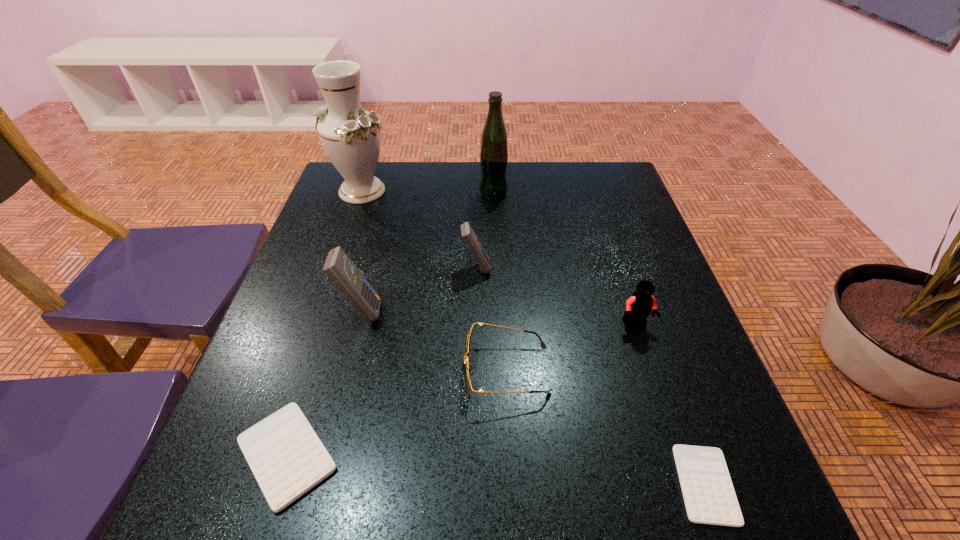
Locate which calculator ranks in proximity to the third tallest object. Please provide its 2D coordinates. Your answer should be formatted as a tuple, i.e. [(x, y)], where the tuple contains the x and y coordinates of a point satisfying the conditions above.

[(468, 234)]

Identify which calculator is located as the second nearest to the vase. Please provide its 2D coordinates. Your answer should be formatted as a tuple, i.e. [(x, y)], where the tuple contains the x and y coordinates of a point satisfying the conditions above.

[(338, 267)]

Find the location of a particular element. This screenshot has width=960, height=540. free space that satisfies the following two spatial constraints: 1. on the front side of the vase; 2. on the right side of the green beer bottle is located at coordinates (362, 193).

Locate an element on the screen. Image resolution: width=960 pixels, height=540 pixels. vacant space that satisfies the following two spatial constraints: 1. on the front side of the right white calculator; 2. on the right side of the tallest object is located at coordinates (260, 484).

The height and width of the screenshot is (540, 960). Identify the location of vacant space that satisfies the following two spatial constraints: 1. on the front side of the tallest object; 2. on the left side of the bigger white calculator. (271, 455).

Identify the location of free space that satisfies the following two spatial constraints: 1. on the back side of the green beer bottle; 2. on the right side of the bigger white calculator. The width and height of the screenshot is (960, 540). (371, 193).

This screenshot has height=540, width=960. Find the location of `free location that satisfies the following two spatial constraints: 1. on the front side of the bigger white calculator; 2. on the right side of the vase`. free location that satisfies the following two spatial constraints: 1. on the front side of the bigger white calculator; 2. on the right side of the vase is located at coordinates (271, 455).